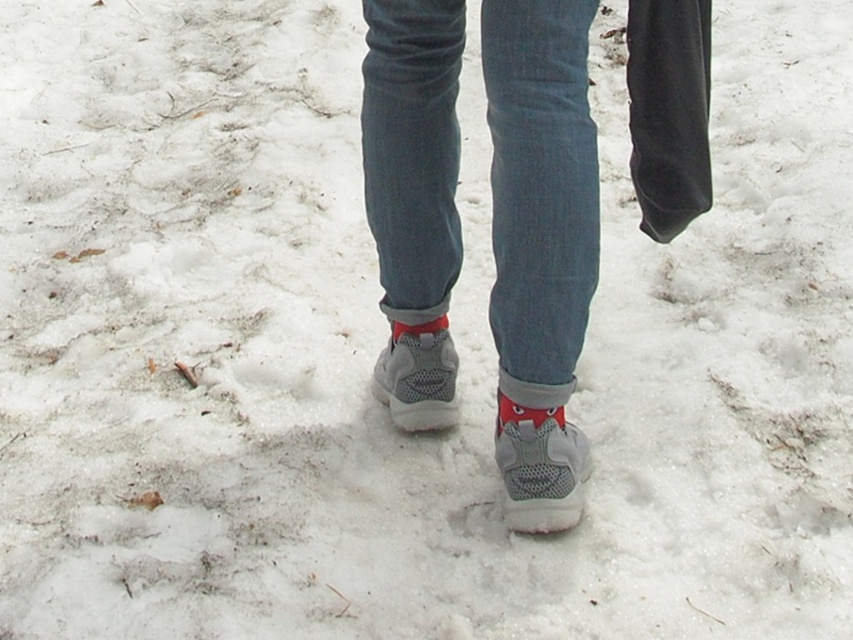
Question: Is denim at center below red suede sock at lower center?

Choices:
 (A) yes
 (B) no

Answer: (B)

Question: Can you confirm if denim at center is positioned to the left of red suede sock at lower center?

Choices:
 (A) yes
 (B) no

Answer: (A)

Question: Is denim at center to the right of red suede sock at lower center from the viewer's perspective?

Choices:
 (A) no
 (B) yes

Answer: (A)

Question: Which point is farther to the camera?

Choices:
 (A) (558, 387)
 (B) (495, 154)

Answer: (A)